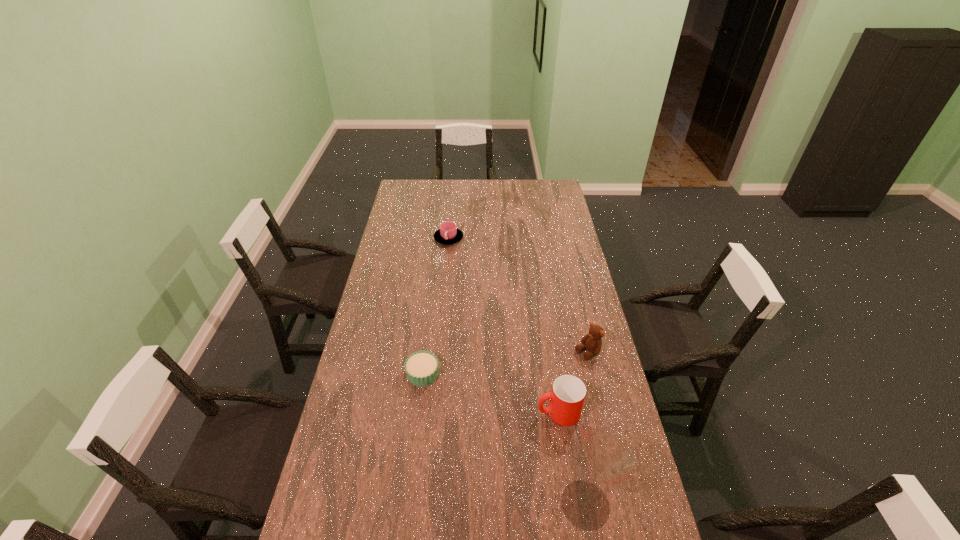
Locate an element on the screen. The width and height of the screenshot is (960, 540). cupcake is located at coordinates 421,368.

This screenshot has height=540, width=960. What are the coordinates of `the nearest object` in the screenshot? It's located at (603, 460).

Where is `flute glass`? The image size is (960, 540). flute glass is located at coordinates (603, 460).

You are a GUI agent. You are given a task and a screenshot of the screen. Output one action in this format:
    pyautogui.click(x=<x>, y=<y>)
    Task: Click on the teddy bear
    
    Given the screenshot: What is the action you would take?
    point(592,342)

Find the location of `the right cup`. the right cup is located at coordinates (568, 392).

Where is `the nearer cup`? Image resolution: width=960 pixels, height=540 pixels. the nearer cup is located at coordinates (568, 392).

Find the location of a particular element. the left cup is located at coordinates (448, 233).

Find the location of a particular element. This screenshot has width=960, height=540. the farther cup is located at coordinates (448, 233).

The height and width of the screenshot is (540, 960). Identify the location of vacant space located 0.170m on the back of the cupcake. (429, 326).

The image size is (960, 540). I want to click on free space located 0.080m on the right of the flute glass, so (642, 504).